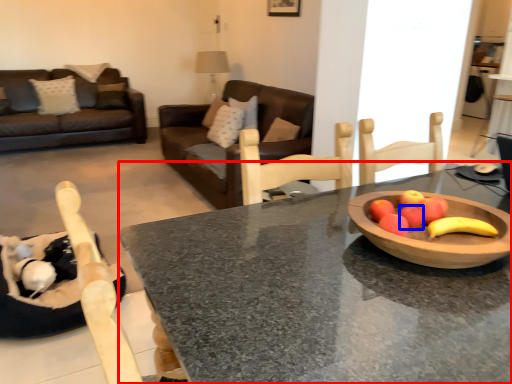
Question: Which point is closer to the camera, desk (highlighted by a red box) or apple (highlighted by a blue box)?

Choices:
 (A) desk
 (B) apple

Answer: (A)